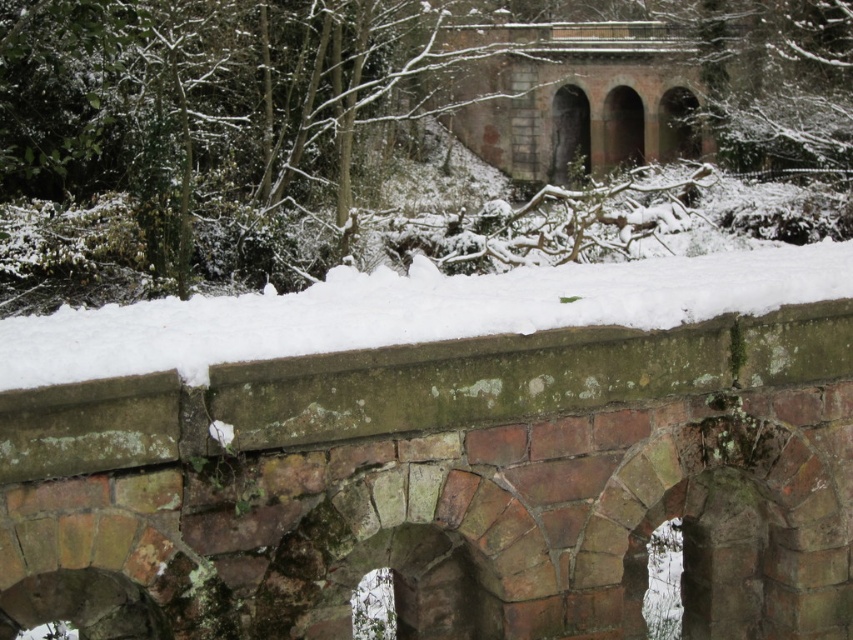
You are an artist planning to paint the winter scene. You want to ensure the green leafy tree at center and the white powdery snow at center are proportionally accurate. Which object should you make bigger in your painting?

The green leafy tree at center should be made bigger than the white powdery snow at center because it is larger in size according to the description.

You are standing on the stone bridge and looking towards the green leafy tree at center and the white powdery snow at center. Which object is higher from the ground?

The green leafy tree at center is located above the white powdery snow at center, so the green leafy tree at center is higher from the ground.